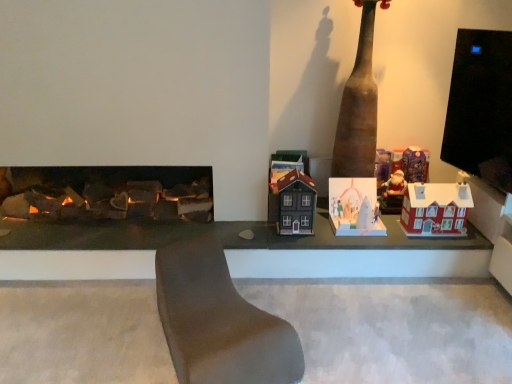
Question: Can you see matte brown house at center, the 1th toy from the left, touching brown leather couch at center?

Choices:
 (A) yes
 (B) no

Answer: (B)

Question: Is matte brown house at center, acting as the 4th toy starting from the right, behind brown leather couch at center?

Choices:
 (A) yes
 (B) no

Answer: (A)

Question: From the image's perspective, would you say matte brown house at center, acting as the 4th toy starting from the right, is shown under brown leather couch at center?

Choices:
 (A) yes
 (B) no

Answer: (B)

Question: Is matte brown house at center, acting as the 4th toy starting from the right, wider than brown leather couch at center?

Choices:
 (A) no
 (B) yes

Answer: (A)

Question: From a real-world perspective, is matte brown house at center, the 1th toy from the left, over brown leather couch at center?

Choices:
 (A) yes
 (B) no

Answer: (A)

Question: Considering the positions of red matte house at right, the first toy positioned from the right, and brown leather couch at center in the image, is red matte house at right, the first toy positioned from the right, wider or thinner than brown leather couch at center?

Choices:
 (A) wide
 (B) thin

Answer: (B)

Question: From a real-world perspective, relative to brown leather couch at center, is red matte house at right, the first toy positioned from the right, vertically above or below?

Choices:
 (A) above
 (B) below

Answer: (A)

Question: Based on their positions, is red matte house at right, the first toy positioned from the right, located to the left or right of brown leather couch at center?

Choices:
 (A) left
 (B) right

Answer: (B)

Question: Does point (415, 198) appear closer or farther from the camera than point (215, 314)?

Choices:
 (A) closer
 (B) farther

Answer: (B)

Question: From the image's perspective, is shiny purple wrapping paper at upper right, positioned as the 2th toy in right-to-left order, positioned above or below brown leather couch at center?

Choices:
 (A) above
 (B) below

Answer: (A)

Question: From their relative heights in the image, would you say shiny purple wrapping paper at upper right, the third toy when ordered from left to right, is taller or shorter than brown leather couch at center?

Choices:
 (A) tall
 (B) short

Answer: (B)

Question: Considering the positions of shiny purple wrapping paper at upper right, the third toy when ordered from left to right, and brown leather couch at center in the image, is shiny purple wrapping paper at upper right, the third toy when ordered from left to right, wider or thinner than brown leather couch at center?

Choices:
 (A) thin
 (B) wide

Answer: (A)

Question: Is point (407, 178) positioned closer to the camera than point (181, 336)?

Choices:
 (A) closer
 (B) farther

Answer: (B)

Question: Is point (369, 59) closer or farther from the camera than point (401, 220)?

Choices:
 (A) farther
 (B) closer

Answer: (B)

Question: Considering their positions, is brown matte totem pole at center located in front of or behind red matte house at right, the first toy positioned from the right?

Choices:
 (A) behind
 (B) front

Answer: (B)